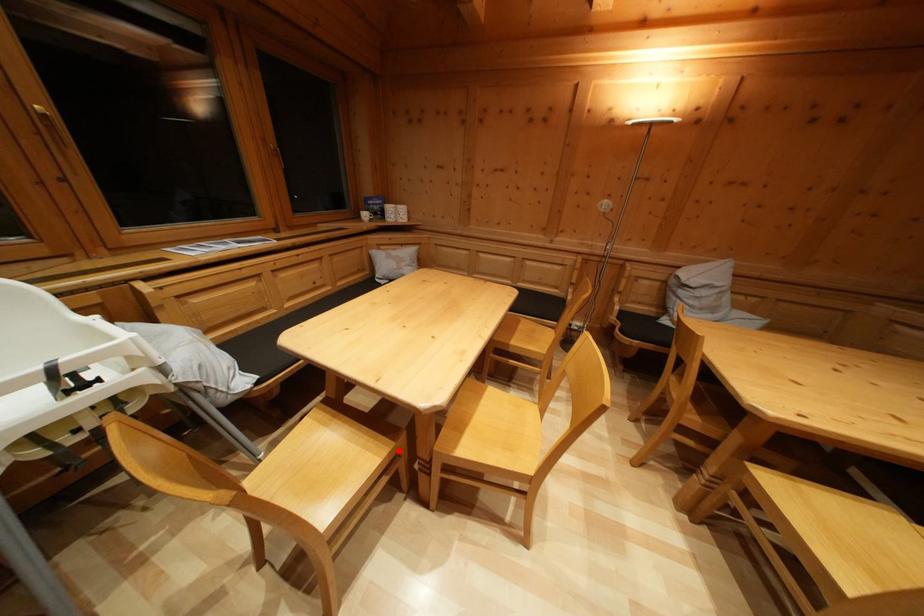
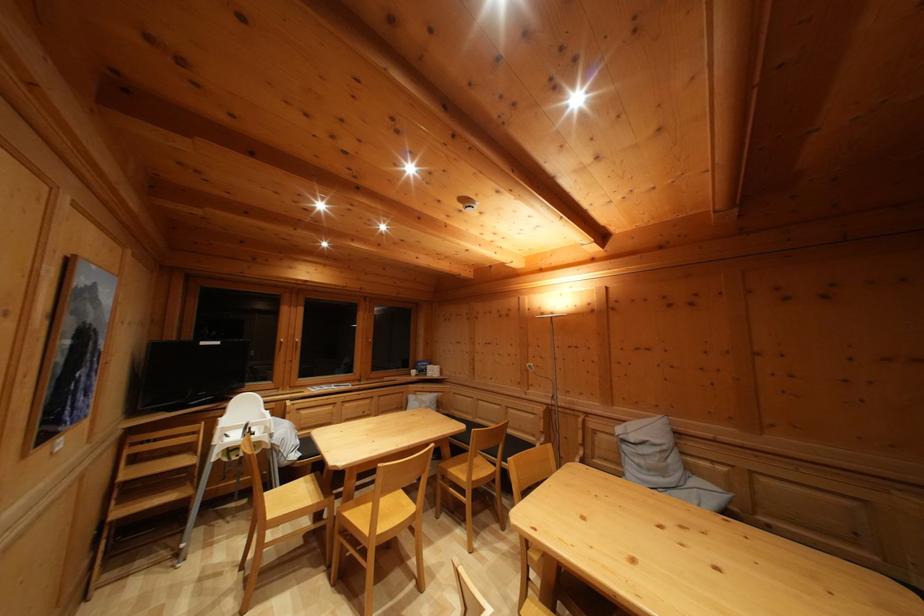
In the second image, find the point that corresponds to the highlighted location in the first image.

(329, 506)